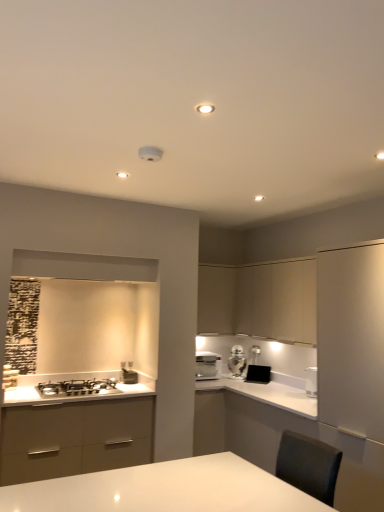
Question: Does satin silver gas stove at lower left have a larger size compared to matte beige cabinet at upper center, which is counted as the 2th cabinetry, starting from the right?

Choices:
 (A) yes
 (B) no

Answer: (B)

Question: From the image's perspective, does satin silver gas stove at lower left appear higher than matte beige cabinet at upper center, which is counted as the 2th cabinetry, starting from the right?

Choices:
 (A) no
 (B) yes

Answer: (A)

Question: Can you confirm if satin silver gas stove at lower left is shorter than matte beige cabinet at upper center, which is counted as the 2th cabinetry, starting from the right?

Choices:
 (A) no
 (B) yes

Answer: (B)

Question: Considering the relative sizes of satin silver gas stove at lower left and matte beige cabinet at upper center, the first cabinetry from the left, in the image provided, is satin silver gas stove at lower left wider than matte beige cabinet at upper center, the first cabinetry from the left,?

Choices:
 (A) no
 (B) yes

Answer: (B)

Question: Can you see satin silver gas stove at lower left touching matte beige cabinet at upper center, the first cabinetry from the left?

Choices:
 (A) yes
 (B) no

Answer: (B)

Question: Looking at the image, does black matte toaster at center, the 1th appliance when ordered from right to left, seem bigger or smaller compared to white glossy coffee machine at center?

Choices:
 (A) small
 (B) big

Answer: (A)

Question: Visually, is black matte toaster at center, the second appliance from the left, positioned to the left or to the right of white glossy coffee machine at center?

Choices:
 (A) left
 (B) right

Answer: (B)

Question: From a real-world perspective, is black matte toaster at center, the 1th appliance when ordered from right to left, physically located above or below white glossy coffee machine at center?

Choices:
 (A) above
 (B) below

Answer: (B)

Question: Is point (251, 375) closer or farther from the camera than point (213, 361)?

Choices:
 (A) closer
 (B) farther

Answer: (A)

Question: From a real-world perspective, is white glossy countertop at center physically located above or below white glossy toaster at upper center?

Choices:
 (A) above
 (B) below

Answer: (B)

Question: In terms of width, does white glossy countertop at center look wider or thinner when compared to white glossy toaster at upper center?

Choices:
 (A) wide
 (B) thin

Answer: (A)

Question: From the image's perspective, relative to white glossy toaster at upper center, is white glossy countertop at center above or below?

Choices:
 (A) above
 (B) below

Answer: (B)

Question: Considering the positions of white glossy countertop at center and white glossy toaster at upper center in the image, is white glossy countertop at center taller or shorter than white glossy toaster at upper center?

Choices:
 (A) short
 (B) tall

Answer: (B)

Question: From a real-world perspective, is white glossy coffee machine at center positioned above or below white glossy toaster at upper center?

Choices:
 (A) above
 (B) below

Answer: (B)

Question: In terms of size, does white glossy coffee machine at center appear bigger or smaller than white glossy toaster at upper center?

Choices:
 (A) small
 (B) big

Answer: (B)